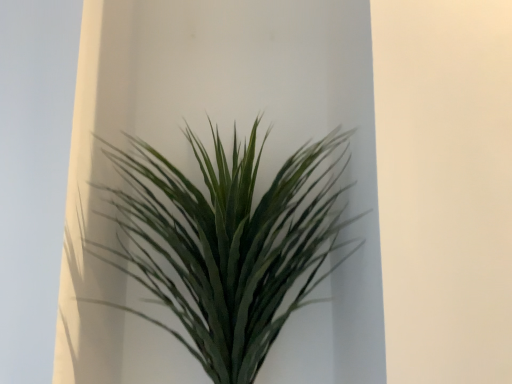
Describe the element at coordinates (227, 242) in the screenshot. I see `green matte plant at center` at that location.

The height and width of the screenshot is (384, 512). I want to click on green matte plant at center, so click(227, 242).

Image resolution: width=512 pixels, height=384 pixels. In order to click on green matte plant at center in this screenshot , I will do `click(227, 242)`.